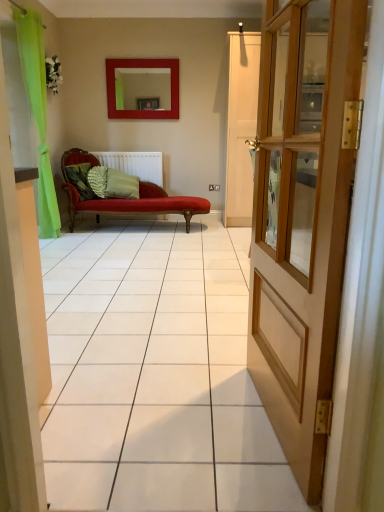
Question: Is green fabric pillow at center, positioned as the 3th pillow in left-to-right order, to the left of white matte radiator at center from the viewer's perspective?

Choices:
 (A) yes
 (B) no

Answer: (B)

Question: Is green fabric pillow at center, positioned as the 3th pillow in left-to-right order, oriented towards white matte radiator at center?

Choices:
 (A) no
 (B) yes

Answer: (A)

Question: Considering the relative sizes of green fabric pillow at center, positioned as the 3th pillow in left-to-right order, and white matte radiator at center in the image provided, is green fabric pillow at center, positioned as the 3th pillow in left-to-right order, bigger than white matte radiator at center?

Choices:
 (A) no
 (B) yes

Answer: (B)

Question: Can we say green fabric pillow at center, the first pillow in the right-to-left sequence, lies outside white matte radiator at center?

Choices:
 (A) yes
 (B) no

Answer: (A)

Question: Considering the relative sizes of green fabric pillow at center, the first pillow in the right-to-left sequence, and white matte radiator at center in the image provided, is green fabric pillow at center, the first pillow in the right-to-left sequence, smaller than white matte radiator at center?

Choices:
 (A) no
 (B) yes

Answer: (A)

Question: Looking at the image, does green fabric pillow at center, positioned as the 3th pillow in left-to-right order, seem bigger or smaller compared to camouflage fabric pillow at center, the 1th pillow from the left?

Choices:
 (A) small
 (B) big

Answer: (B)

Question: Considering the positions of green fabric pillow at center, positioned as the 3th pillow in left-to-right order, and camouflage fabric pillow at center, which appears as the third pillow when viewed from the right, in the image, is green fabric pillow at center, positioned as the 3th pillow in left-to-right order, taller or shorter than camouflage fabric pillow at center, which appears as the third pillow when viewed from the right,?

Choices:
 (A) tall
 (B) short

Answer: (A)

Question: Looking at their shapes, would you say green fabric pillow at center, positioned as the 3th pillow in left-to-right order, is wider or thinner than camouflage fabric pillow at center, the 1th pillow from the left?

Choices:
 (A) wide
 (B) thin

Answer: (A)

Question: In the image, is green fabric pillow at center, positioned as the 3th pillow in left-to-right order, positioned in front of or behind camouflage fabric pillow at center, which appears as the third pillow when viewed from the right?

Choices:
 (A) behind
 (B) front

Answer: (A)

Question: From a real-world perspective, is wooden door at right above or below matte red mirror at upper center?

Choices:
 (A) below
 (B) above

Answer: (A)

Question: Is wooden door at right in front of or behind matte red mirror at upper center in the image?

Choices:
 (A) behind
 (B) front

Answer: (B)

Question: Is wooden door at right wider or thinner than matte red mirror at upper center?

Choices:
 (A) thin
 (B) wide

Answer: (B)

Question: Would you say wooden door at right is to the left or to the right of matte red mirror at upper center in the picture?

Choices:
 (A) right
 (B) left

Answer: (A)

Question: Is matte red mirror at upper center wider or thinner than camouflage fabric pillow at center, which appears as the third pillow when viewed from the right?

Choices:
 (A) wide
 (B) thin

Answer: (B)

Question: Considering the positions of matte red mirror at upper center and camouflage fabric pillow at center, which appears as the third pillow when viewed from the right, in the image, is matte red mirror at upper center taller or shorter than camouflage fabric pillow at center, which appears as the third pillow when viewed from the right,?

Choices:
 (A) tall
 (B) short

Answer: (A)